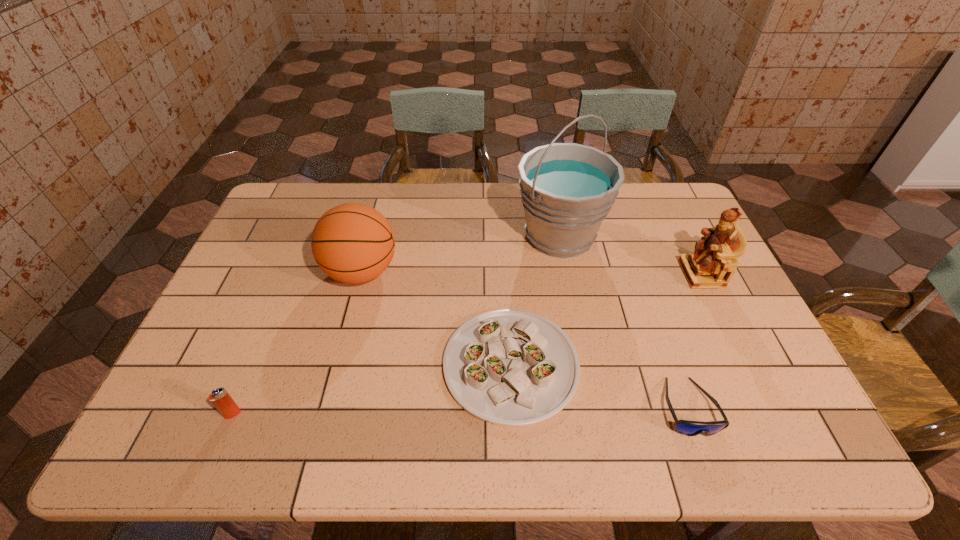
You are a GUI agent. You are given a task and a screenshot of the screen. Output one action in this format:
    pyautogui.click(x=<x>, y=<y>)
    Task: Click on the bucket
    This screenshot has width=960, height=540.
    Given the screenshot: What is the action you would take?
    pyautogui.click(x=567, y=189)

Locate an element on the screen. This screenshot has height=540, width=960. the rightmost object is located at coordinates (713, 263).

Identify the location of the fifth object from right to left. Image resolution: width=960 pixels, height=540 pixels. (353, 243).

This screenshot has height=540, width=960. I want to click on the leftmost object, so coord(223,402).

Locate an element on the screen. the fourth tallest object is located at coordinates (223, 402).

At what (x,y) coordinates should I click in order to perform the action: click on sunglasses. Please return your answer as a coordinate pair (x, y). The width and height of the screenshot is (960, 540). Looking at the image, I should click on (685, 427).

You are a GUI agent. You are given a task and a screenshot of the screen. Output one action in this format:
    pyautogui.click(x=<x>, y=<y>)
    Task: Click on the platter
    The width and height of the screenshot is (960, 540).
    Given the screenshot: What is the action you would take?
    pyautogui.click(x=508, y=367)

Locate an element on the screen. This screenshot has width=960, height=540. free space located on the right of the tallest object is located at coordinates (670, 236).

Locate an element on the screen. vacant space located 0.160m on the front-facing side of the figurine is located at coordinates (631, 274).

Where is `vacant region located on the front-facing side of the figurine`? The width and height of the screenshot is (960, 540). vacant region located on the front-facing side of the figurine is located at coordinates (564, 274).